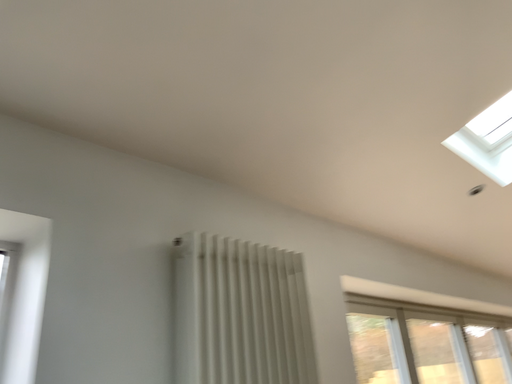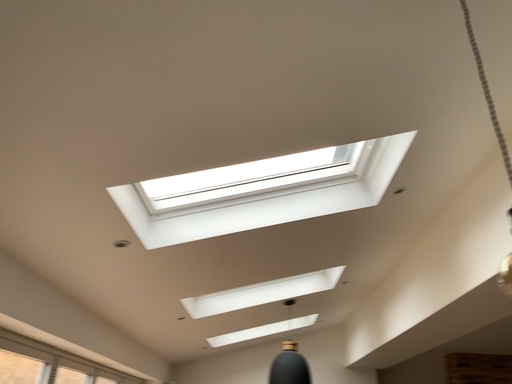
Question: Which way did the camera rotate in the video?

Choices:
 (A) rotated right
 (B) rotated left

Answer: (A)